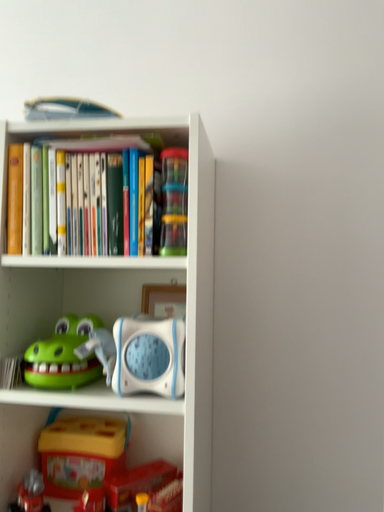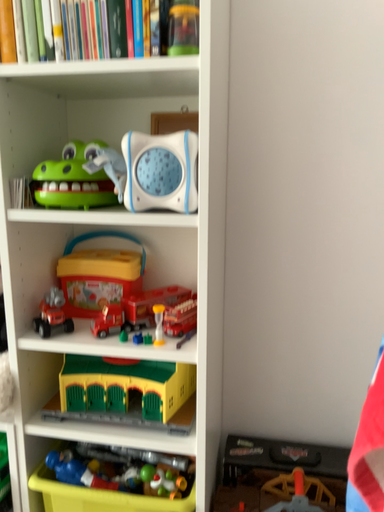
Question: How did the camera likely rotate when shooting the video?

Choices:
 (A) rotated upward
 (B) rotated downward

Answer: (B)